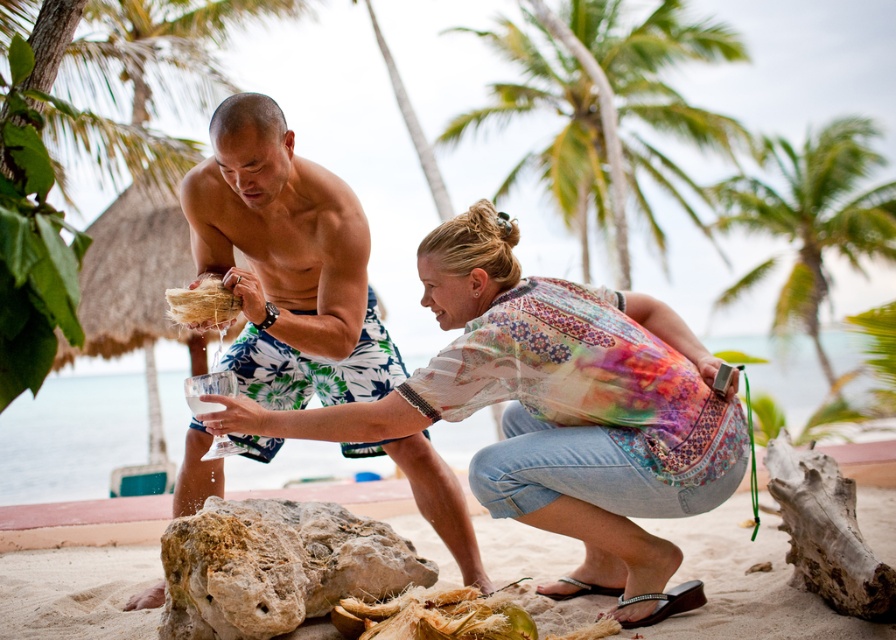
Question: Is shiny blue shorts at center to the left of green leafy palm tree at upper center from the viewer's perspective?

Choices:
 (A) yes
 (B) no

Answer: (A)

Question: Which object appears farthest from the camera in this image?

Choices:
 (A) printed cotton blouse at center
 (B) green leafy palm tree at upper center

Answer: (B)

Question: Is printed cotton blouse at center to the left of rusty textured rock at center from the viewer's perspective?

Choices:
 (A) no
 (B) yes

Answer: (A)

Question: Does shiny blue shorts at center appear on the right side of rusty textured rock at center?

Choices:
 (A) no
 (B) yes

Answer: (A)

Question: Which point is farther to the camera?

Choices:
 (A) (445, 419)
 (B) (688, 132)
 (C) (367, 397)

Answer: (B)

Question: Among these points, which one is farthest from the camera?

Choices:
 (A) (326, 536)
 (B) (599, 202)
 (C) (431, 394)

Answer: (B)